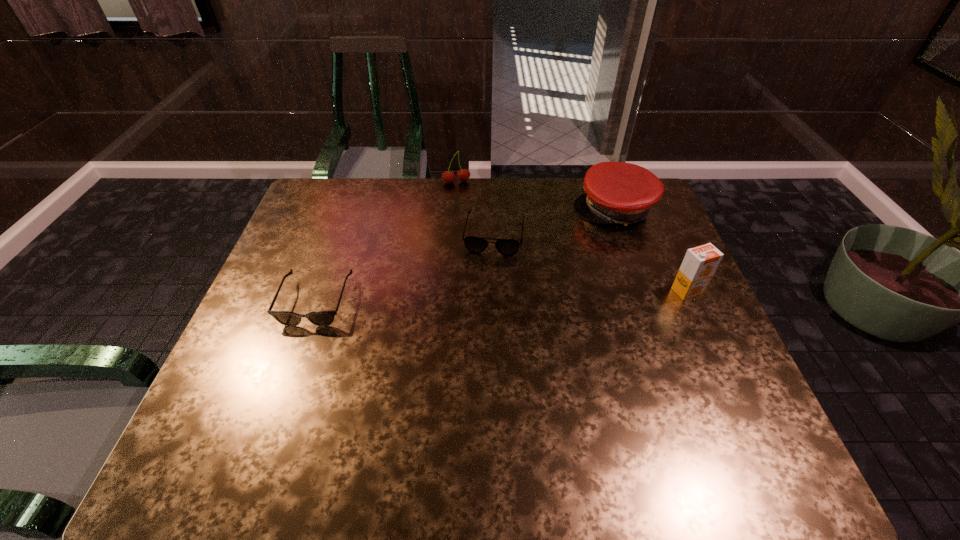
I want to click on orange juice positioned at the right edge, so click(700, 263).

The width and height of the screenshot is (960, 540). In order to click on cap present at the right edge in this screenshot , I will do `click(616, 192)`.

Locate an element on the screen. Image resolution: width=960 pixels, height=540 pixels. object that is at the far right corner is located at coordinates (616, 192).

Locate an element on the screen. Image resolution: width=960 pixels, height=540 pixels. free space at the far edge is located at coordinates pos(497,189).

The image size is (960, 540). Identify the location of vacant space at the near edge of the desktop. (368, 395).

This screenshot has width=960, height=540. Find the location of `free space at the left edge of the desktop`. free space at the left edge of the desktop is located at coordinates (302, 336).

Where is `free space at the right edge of the desktop`? free space at the right edge of the desktop is located at coordinates (660, 300).

Identify the location of free region at the far left corner of the desktop. (324, 221).

Locate an element on the screen. The image size is (960, 540). vacant region at the near right corner is located at coordinates (694, 401).

You are a GUI agent. You are given a task and a screenshot of the screen. Output one action in this format:
    pyautogui.click(x=<x>, y=<y>)
    Task: Click on the vacant area between the tallest object and the spectacles
    
    Given the screenshot: What is the action you would take?
    pyautogui.click(x=591, y=262)